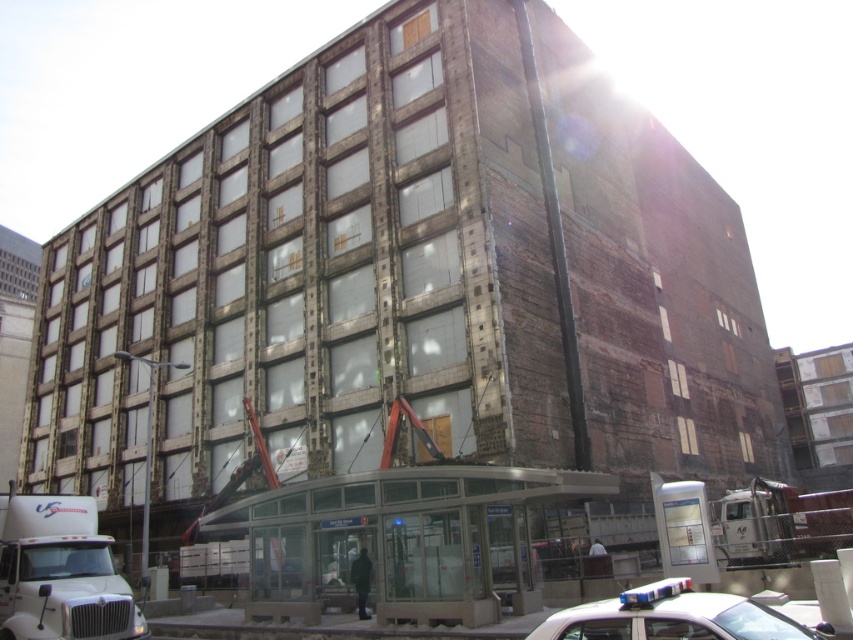
Question: Can you confirm if white plastic car at lower right is positioned above white metallic truck at lower right?

Choices:
 (A) yes
 (B) no

Answer: (A)

Question: Can you confirm if white matte truck at lower left is wider than white metallic truck at lower right?

Choices:
 (A) yes
 (B) no

Answer: (A)

Question: Which point is farther to the camera?

Choices:
 (A) white metallic truck at lower right
 (B) white plastic car at lower right
 (C) white matte truck at lower left

Answer: (A)

Question: Which object appears farthest from the camera in this image?

Choices:
 (A) white matte truck at lower left
 (B) white metallic truck at lower right

Answer: (B)

Question: Which is nearer to the white metallic truck at lower right?

Choices:
 (A) white matte truck at lower left
 (B) white plastic car at lower right

Answer: (B)

Question: Observing the image, what is the correct spatial positioning of white matte truck at lower left in reference to white plastic car at lower right?

Choices:
 (A) left
 (B) right

Answer: (A)